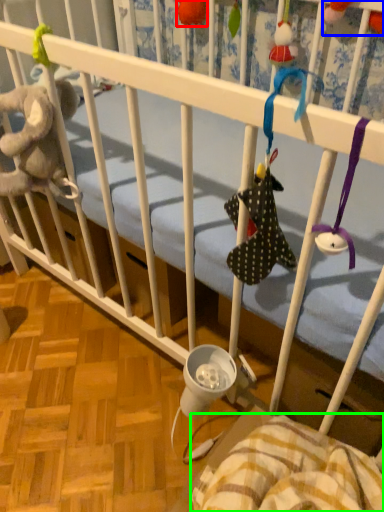
Question: Estimate the real-world distances between objects in this image. Which object is farther from toy (highlighted by a red box), toy (highlighted by a blue box) or blanket (highlighted by a green box)?

Choices:
 (A) toy
 (B) blanket

Answer: (B)